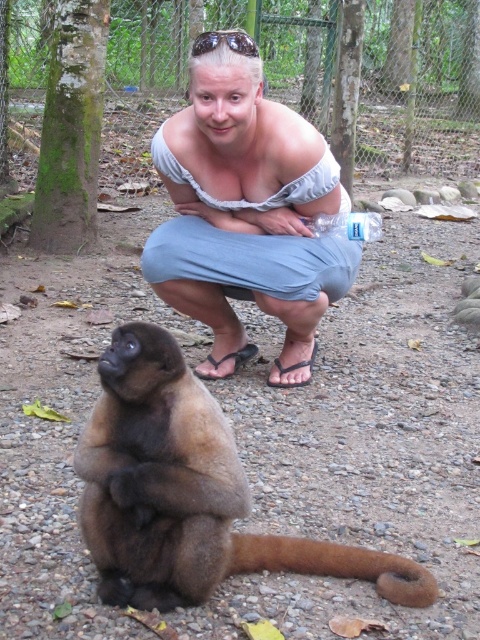
You are a zookeeper observing the scene. You need to place a banana treat between the brown furry monkey at lower left and the brown furry tail at lower center. Based on their positions, where should you place the banana to ensure it is between them?

The brown furry monkey at lower left is to the left of the brown furry tail at lower center. Therefore, placing the banana between them would require positioning it to the right of the brown furry monkey at lower left and to the left of the brown furry tail at lower center.

You are a zookeeper observing the scene. You need to determine if the light blue denim pants at center can be fully covered by the transparent plastic goggles at upper center when placed directly over them. Based on their sizes, what is your conclusion?

The light blue denim pants at center might be wider than transparent plastic goggles at upper center, so the goggles cannot fully cover the pants due to their smaller width.

You are a zookeeper observing the scene. You need to determine the spatial relationship between the light blue denim pants at center and the brown furry tail at lower center. Which object is located to the left of the other?

The light blue denim pants at center is positioned on the left side of brown furry tail at lower center, so the light blue denim pants at center is to the left of the brown furry tail at lower center.